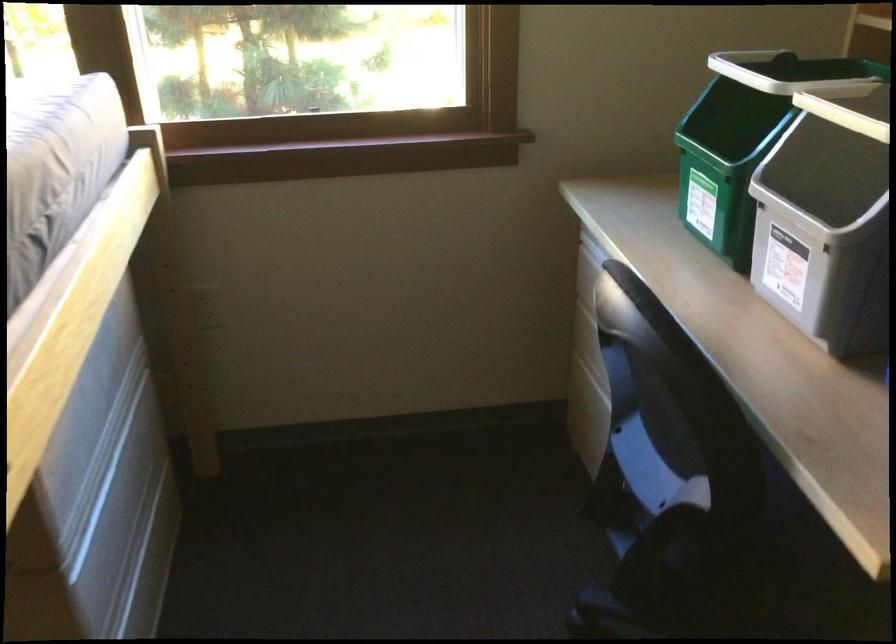
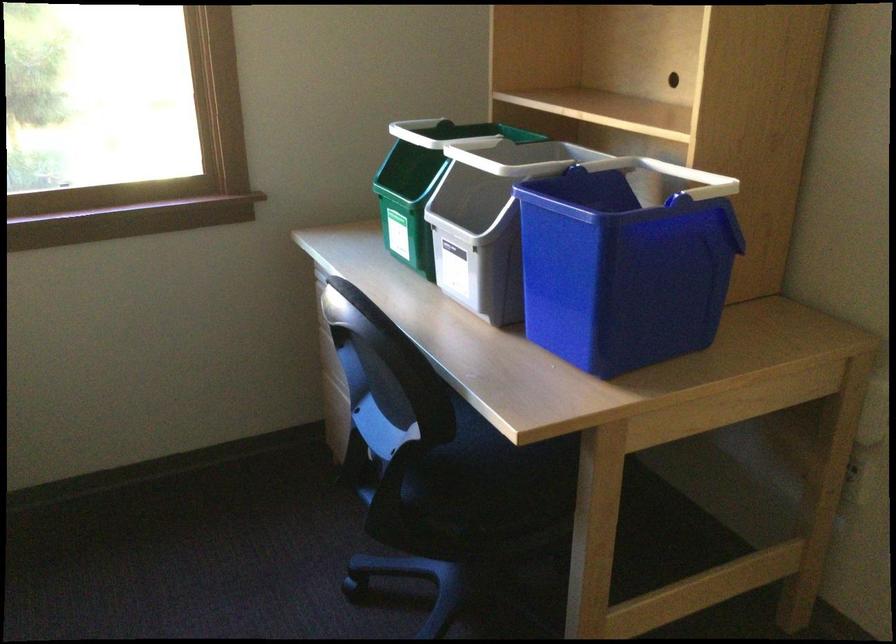
Locate, in the second image, the point that corresponds to the point at 742,565 in the first image.

(460, 494)